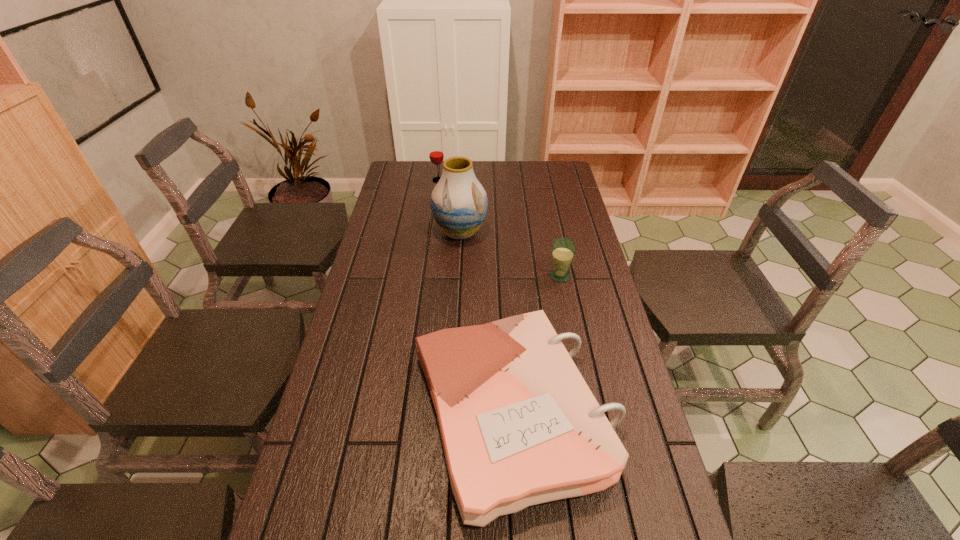
The image size is (960, 540). I want to click on vacant region located 0.170m on the back of the nearest object, so click(x=506, y=289).

The width and height of the screenshot is (960, 540). I want to click on object positioned at the far edge, so click(436, 154).

The width and height of the screenshot is (960, 540). Identify the location of glass that is at the right edge. (563, 249).

The width and height of the screenshot is (960, 540). What are the coordinates of `phonebook located in the right edge section of the desktop` in the screenshot? It's located at (519, 425).

Locate an element on the screen. The width and height of the screenshot is (960, 540). vacant region at the far edge of the desktop is located at coordinates (498, 175).

In the image, there is a desktop. Where is `vacant region at the left edge`? The width and height of the screenshot is (960, 540). vacant region at the left edge is located at coordinates (382, 203).

In the image, there is a desktop. Where is `vacant space at the right edge`? Image resolution: width=960 pixels, height=540 pixels. vacant space at the right edge is located at coordinates [618, 411].

I want to click on free point at the far right corner, so click(533, 171).

The width and height of the screenshot is (960, 540). Find the location of `free point between the phonebook and the second farthest object`. free point between the phonebook and the second farthest object is located at coordinates (487, 323).

Where is `vacant region between the second farthest object and the nearer glass`? The width and height of the screenshot is (960, 540). vacant region between the second farthest object and the nearer glass is located at coordinates (510, 254).